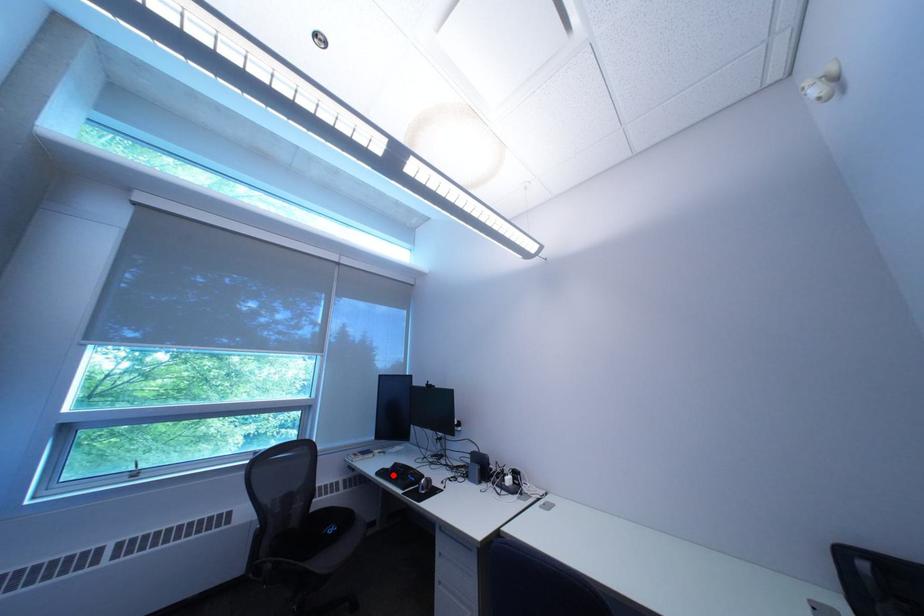
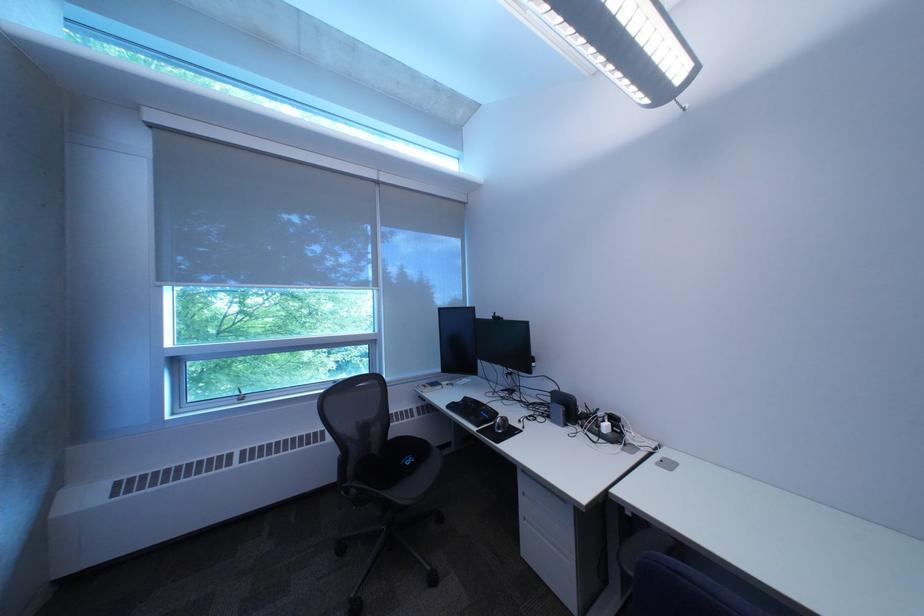
Find the pixel in the second image that matches the highlighted location in the first image.

(464, 408)